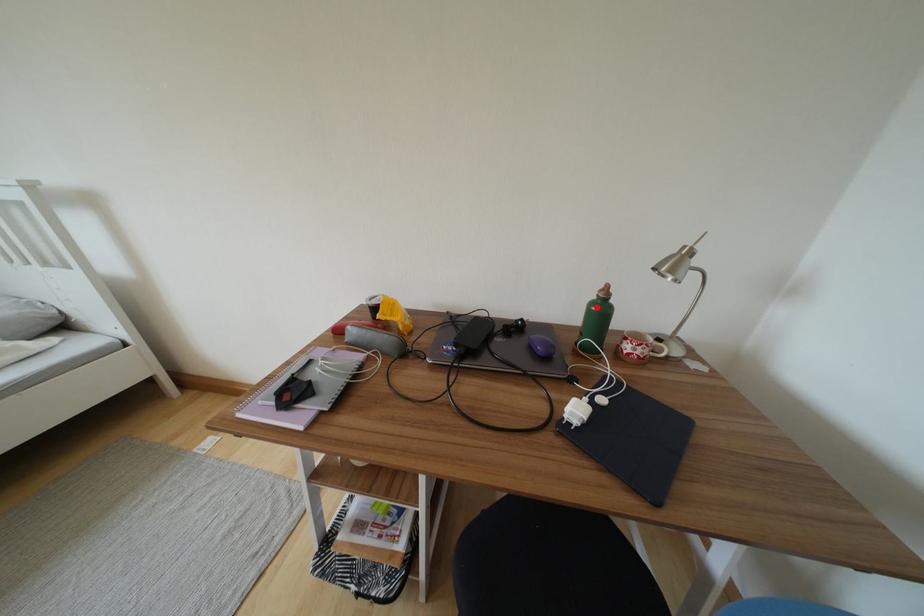
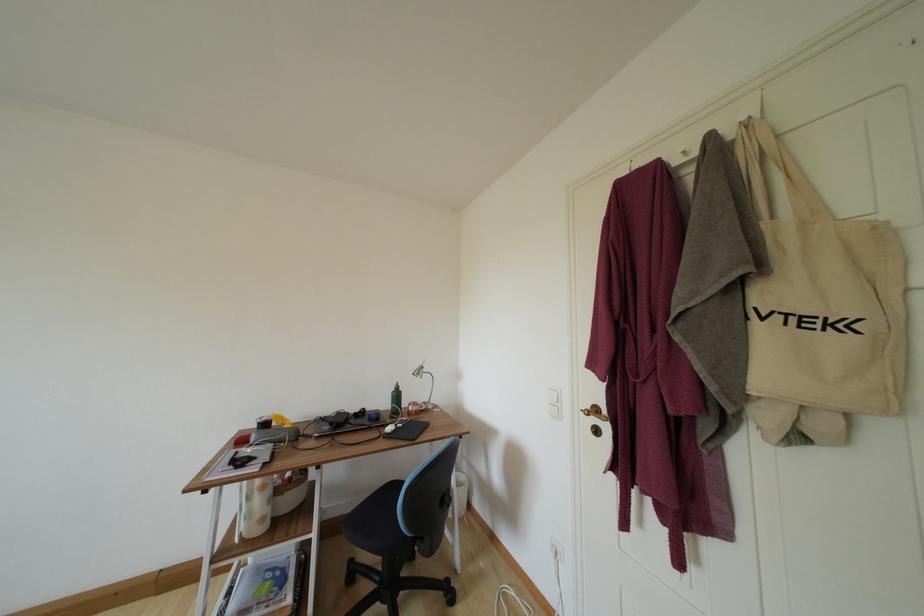
In the second image, find the point that corresponds to the highlighted location in the first image.

(398, 395)